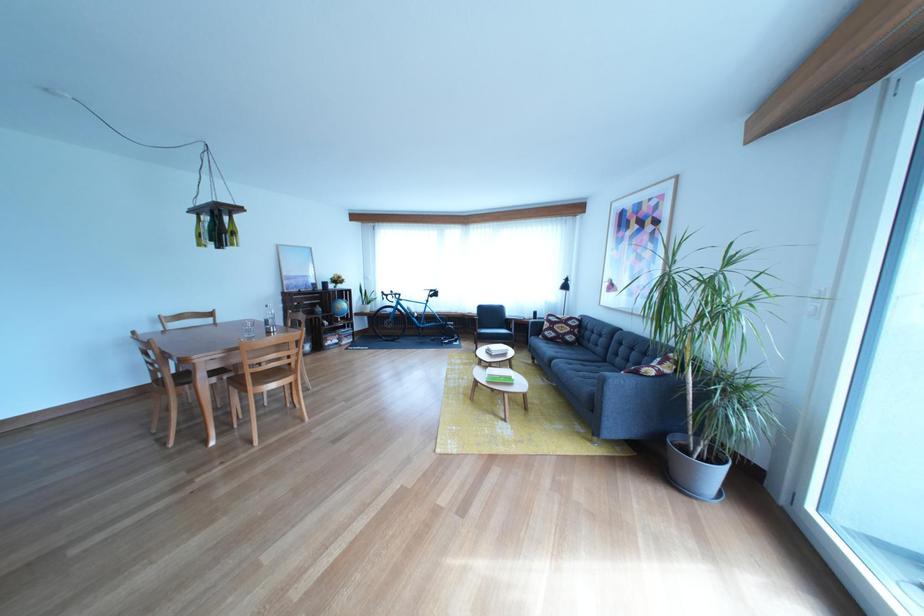
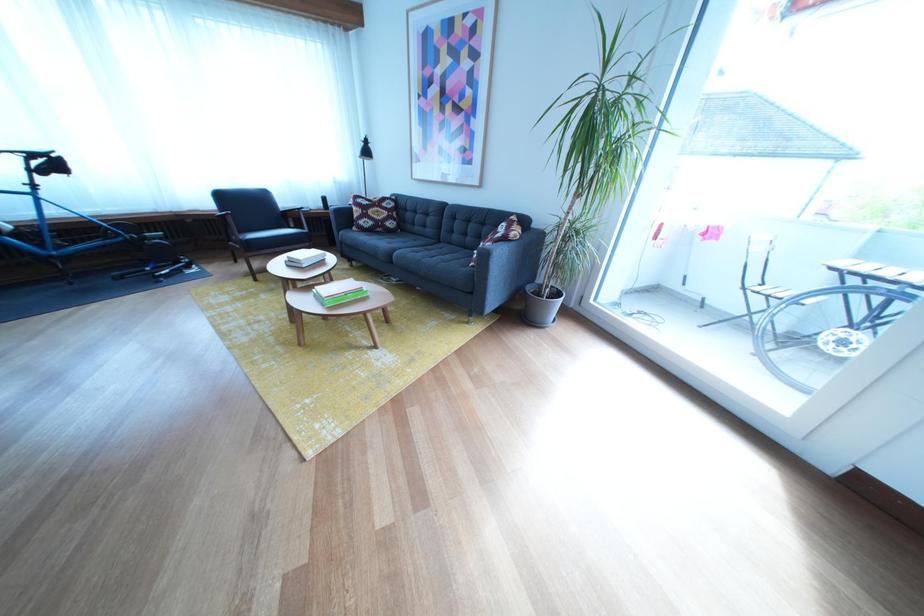
In the second image, find the point that corresponds to (447,300) in the first image.

(64, 169)